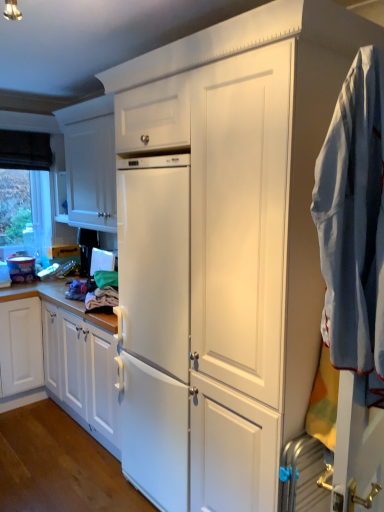
Identify the location of transparent glass window at upper left. The width and height of the screenshot is (384, 512). (16, 213).

What do you see at coordinates (90, 163) in the screenshot? I see `white matte cabinet at upper left` at bounding box center [90, 163].

Identify the location of light blue cotton shirt at right. Image resolution: width=384 pixels, height=512 pixels. (354, 223).

Considering the positions of point (314, 191) and point (3, 232), is point (314, 191) closer or farther from the camera than point (3, 232)?

Point (314, 191).

Which object is positioned more to the left, light blue cotton shirt at right or transparent glass window at upper left?

Positioned to the left is transparent glass window at upper left.

Consider the image. Can you see light blue cotton shirt at right touching transparent glass window at upper left?

No, light blue cotton shirt at right is not in contact with transparent glass window at upper left.

Between light blue cotton shirt at right and transparent glass window at upper left, which one has smaller width?

Thinner between the two is transparent glass window at upper left.

Would you say white matte cabinet at upper left is part of light blue cotton shirt at right's contents?

Actually, white matte cabinet at upper left is outside light blue cotton shirt at right.

How far apart are light blue cotton shirt at right and white matte cabinet at upper left?

They are 7.20 feet apart.

Is light blue cotton shirt at right smaller than white matte cabinet at upper left?

Actually, light blue cotton shirt at right might be larger than white matte cabinet at upper left.

Locate an element on the screen. cabinetry above the light blue cotton shirt at right (from the image's perspective) is located at coordinates (90, 163).

Is point (73, 149) positioned in front of point (31, 253)?

Yes, point (73, 149) is closer to viewer.

Considering the positions of objects white matte cabinet at upper left and transparent glass window at upper left in the image provided, who is in front, white matte cabinet at upper left or transparent glass window at upper left?

white matte cabinet at upper left.

Considering the sizes of objects white matte cabinet at upper left and transparent glass window at upper left in the image provided, who is bigger, white matte cabinet at upper left or transparent glass window at upper left?

white matte cabinet at upper left.

Is white matte cabinet at upper left taller or shorter than transparent glass window at upper left?

white matte cabinet at upper left is taller than transparent glass window at upper left.

Based on the photo, does white matte cabinet at upper left have a greater width compared to light blue cotton shirt at right?

Correct, the width of white matte cabinet at upper left exceeds that of light blue cotton shirt at right.

Is white matte cabinet at upper left with light blue cotton shirt at right?

They are not placed beside each other.

Does white matte cabinet at upper left turn towards light blue cotton shirt at right?

No, white matte cabinet at upper left is not turned towards light blue cotton shirt at right.

From a real-world perspective, is transparent glass window at upper left physically located above or below light blue cotton shirt at right?

Clearly, from a real-world perspective, transparent glass window at upper left is above light blue cotton shirt at right.

Is transparent glass window at upper left facing towards light blue cotton shirt at right?

Yes, transparent glass window at upper left faces towards light blue cotton shirt at right.

Does transparent glass window at upper left appear on the left side of light blue cotton shirt at right?

Correct, you'll find transparent glass window at upper left to the left of light blue cotton shirt at right.

Which of these two, transparent glass window at upper left or light blue cotton shirt at right, stands taller?

light blue cotton shirt at right.

Is transparent glass window at upper left positioned with its back to white matte cabinet at upper left?

No, transparent glass window at upper left's orientation is not away from white matte cabinet at upper left.

Is transparent glass window at upper left beside white matte cabinet at upper left?

No.

In the scene shown: From the image's perspective, who appears lower, transparent glass window at upper left or white matte cabinet at upper left?

transparent glass window at upper left is shown below in the image.

Does transparent glass window at upper left have a greater width compared to white matte cabinet at upper left?

No.

At what (x,y) coordinates should I click in order to perform the action: click on window screen lying on the left of light blue cotton shirt at right. Please return your answer as a coordinate pair (x, y). Looking at the image, I should click on (16, 213).

Identify the location of clothing on the right side of white matte cabinet at upper left. This screenshot has height=512, width=384. (354, 223).

Estimate the real-world distances between objects in this image. Which object is closer to transparent glass window at upper left, white matte cabinet at upper left or light blue cotton shirt at right?

white matte cabinet at upper left lies closer to transparent glass window at upper left than the other object.

From the image, which object appears to be farther from white matte cabinet at upper left, transparent glass window at upper left or light blue cotton shirt at right?

light blue cotton shirt at right is further to white matte cabinet at upper left.

In the scene shown: When comparing their distances from transparent glass window at upper left, does light blue cotton shirt at right or white matte cabinet at upper left seem further?

Based on the image, light blue cotton shirt at right appears to be further to transparent glass window at upper left.

When comparing their distances from light blue cotton shirt at right, does transparent glass window at upper left or white matte cabinet at upper left seem further?

transparent glass window at upper left is positioned further to the anchor light blue cotton shirt at right.

Based on their spatial positions, is white matte cabinet at upper left or transparent glass window at upper left closer to light blue cotton shirt at right?

The object closer to light blue cotton shirt at right is white matte cabinet at upper left.

Looking at the image, which one is located closer to white matte cabinet at upper left, light blue cotton shirt at right or transparent glass window at upper left?

Based on the image, transparent glass window at upper left appears to be nearer to white matte cabinet at upper left.

Identify the location of cabinetry between light blue cotton shirt at right and transparent glass window at upper left along the z-axis. (90, 163).